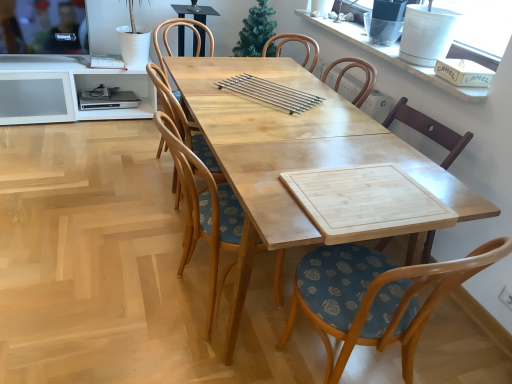
At what (x,y) coordinates should I click in order to perform the action: click on vacant space positioned to the left of light wood table at center. Please return your answer as a coordinate pair (x, y). The height and width of the screenshot is (384, 512). Looking at the image, I should click on (90, 208).